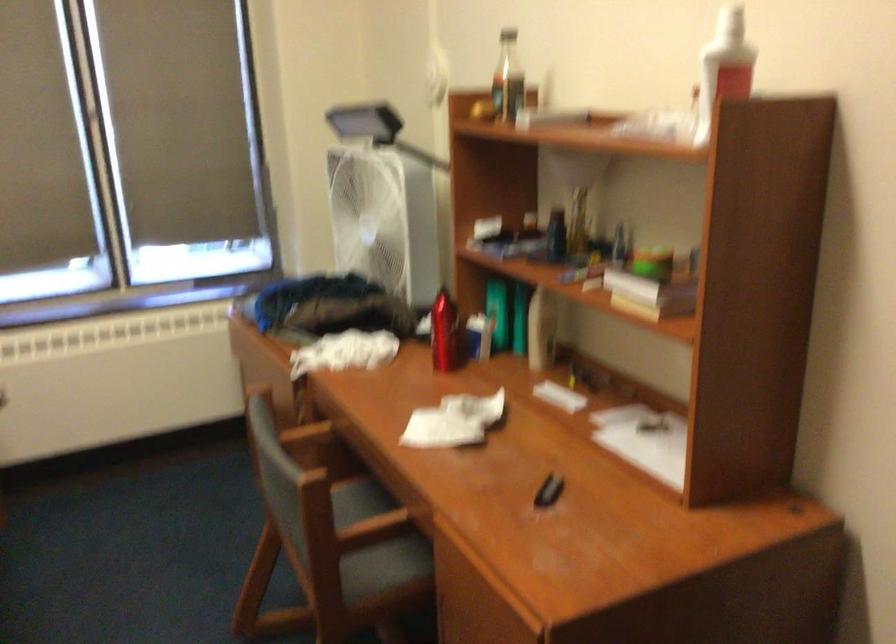
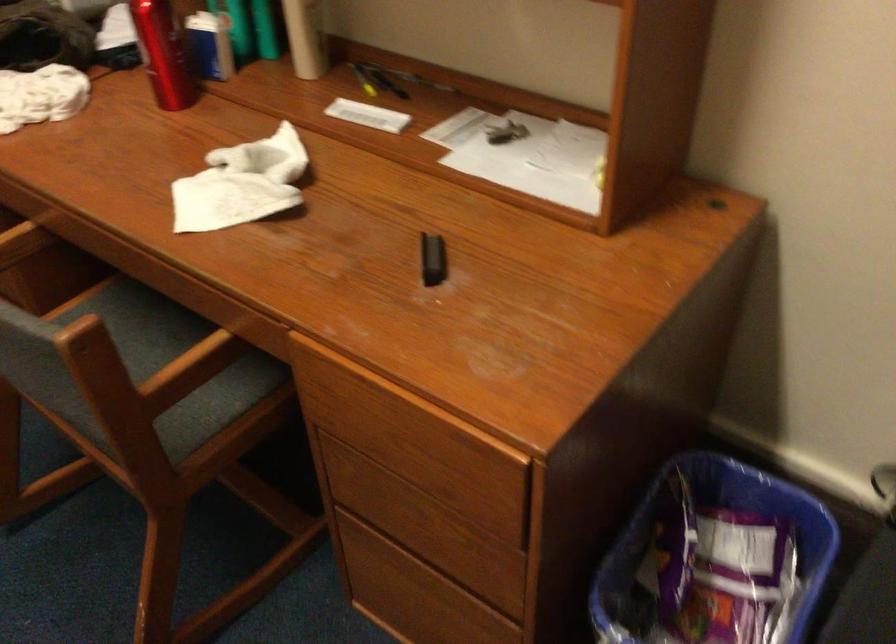
Question: I am providing you with two images of the same scene from different viewpoints. After the viewpoint changes to image2, which objects are now occluded?

Choices:
 (A) yellow pen
 (B) black pen
 (C) red water bottle
 (D) none of these

Answer: (D)